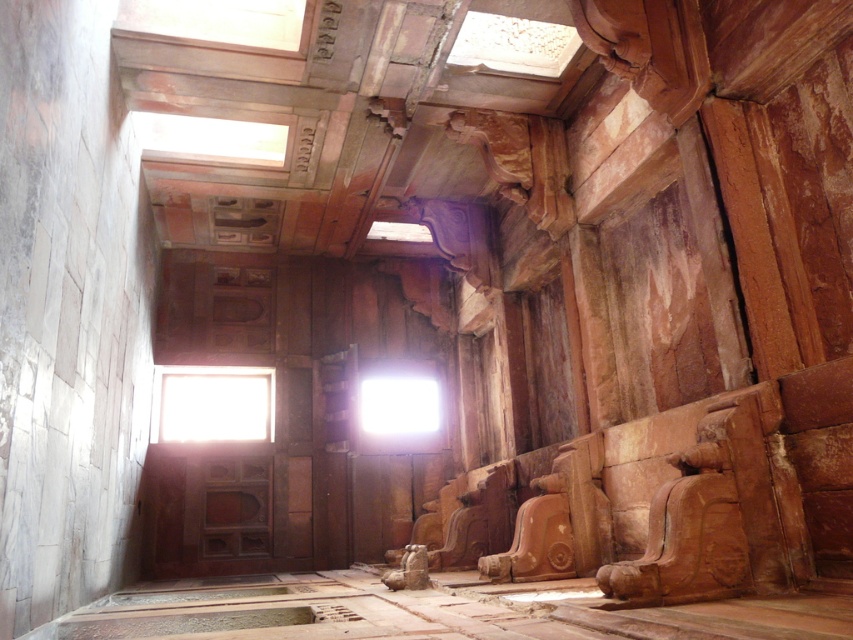
Question: Can you confirm if transparent glass window at center is positioned to the left of bright white glass at center?

Choices:
 (A) yes
 (B) no

Answer: (A)

Question: Does transparent glass window at center lie behind bright white glass at center?

Choices:
 (A) no
 (B) yes

Answer: (A)

Question: Among these objects, which one is nearest to the camera?

Choices:
 (A) transparent glass window at center
 (B) bright white glass at center

Answer: (A)

Question: Is transparent glass window at center below bright white glass at center?

Choices:
 (A) yes
 (B) no

Answer: (B)